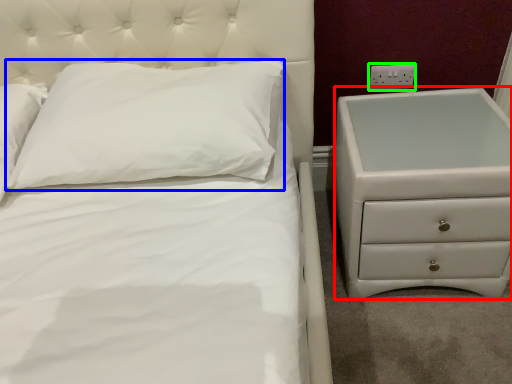
Question: Which object is positioned closest to chest of drawers (highlighted by a red box)? Select from pillow (highlighted by a blue box) and electric outlet (highlighted by a green box).

Choices:
 (A) pillow
 (B) electric outlet

Answer: (B)